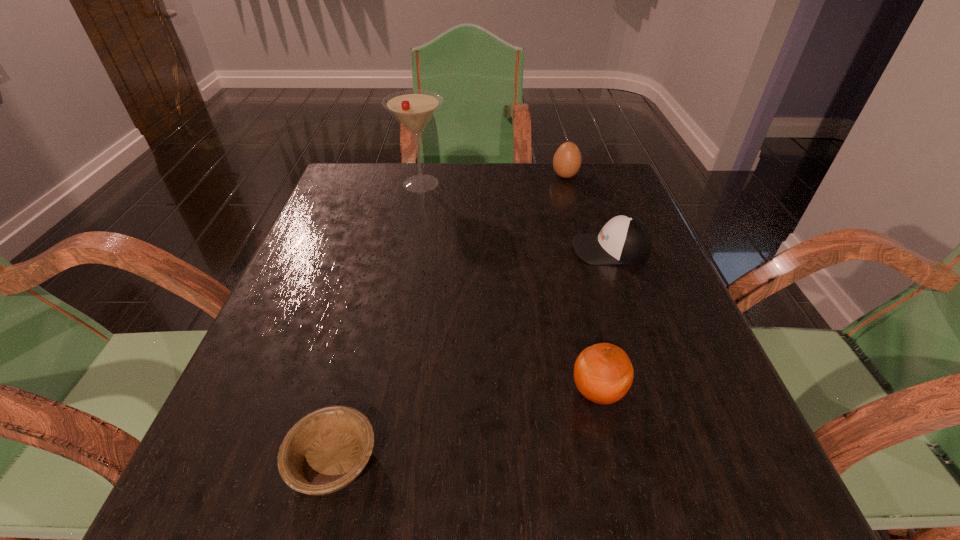
Identify the location of martini. Image resolution: width=960 pixels, height=540 pixels. (413, 109).

At what (x,y) coordinates should I click in order to perform the action: click on boiled egg. Please return your answer as a coordinate pair (x, y). Looking at the image, I should click on (567, 160).

This screenshot has height=540, width=960. In order to click on the second nearest object in this screenshot , I will do `click(603, 373)`.

You are a GUI agent. You are given a task and a screenshot of the screen. Output one action in this format:
    pyautogui.click(x=<x>, y=<y>)
    Task: Click on the third nearest object
    The height and width of the screenshot is (540, 960).
    Given the screenshot: What is the action you would take?
    pyautogui.click(x=625, y=239)

Locate an element on the screen. This screenshot has width=960, height=540. cap is located at coordinates tap(625, 239).

The image size is (960, 540). Identify the location of bowl. (327, 449).

Locate an element on the screen. the shortest object is located at coordinates (327, 449).

Find the location of a particular element. Image resolution: width=960 pixels, height=540 pixels. vacant region located on the right of the martini is located at coordinates (552, 184).

Locate an element on the screen. The width and height of the screenshot is (960, 540). vacant space located 0.250m on the front of the boiled egg is located at coordinates (584, 242).

The height and width of the screenshot is (540, 960). I want to click on vacant point located on the left of the orange, so click(427, 392).